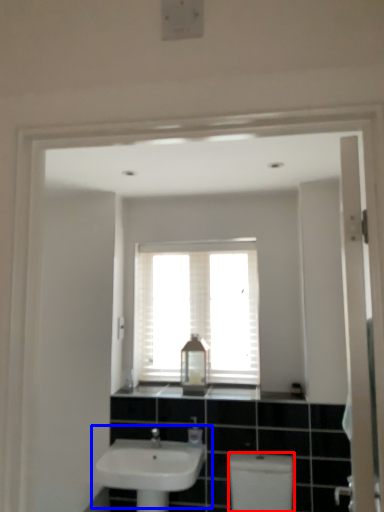
Question: Which object is further to the camera taking this photo, toilet bowl (highlighted by a red box) or sink (highlighted by a blue box)?

Choices:
 (A) toilet bowl
 (B) sink

Answer: (B)